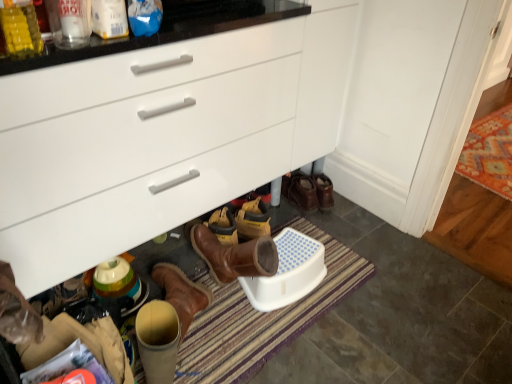
Where is `free spot above white plastic phone at lower center (from a real-world perspective)`? free spot above white plastic phone at lower center (from a real-world perspective) is located at coordinates (287, 261).